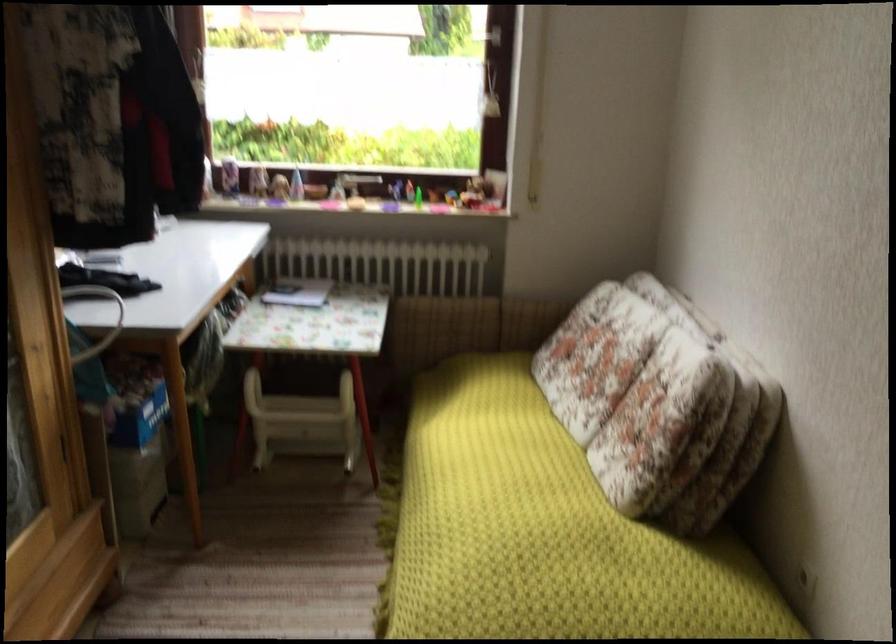
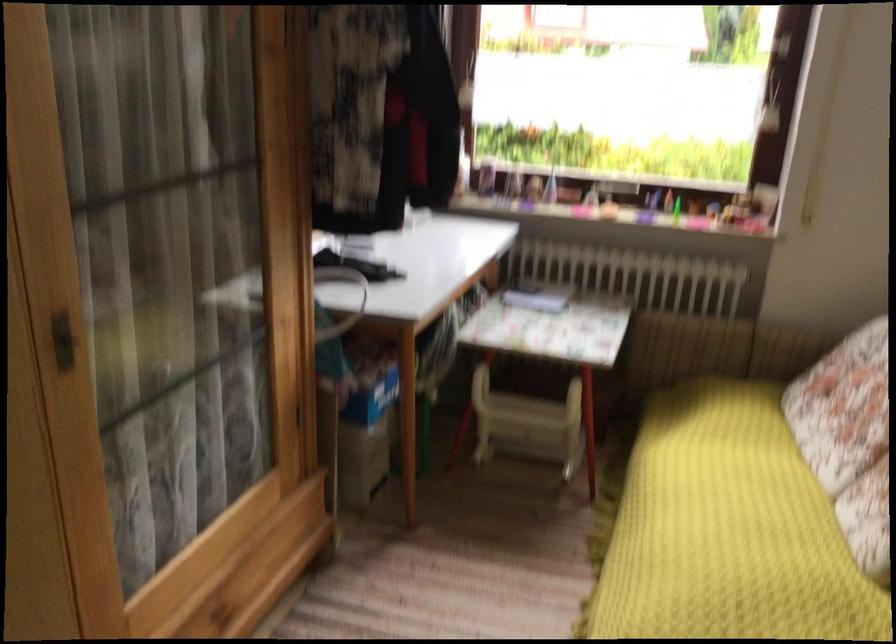
Locate, in the second image, the point that corresponds to [303,422] in the first image.

(528, 424)